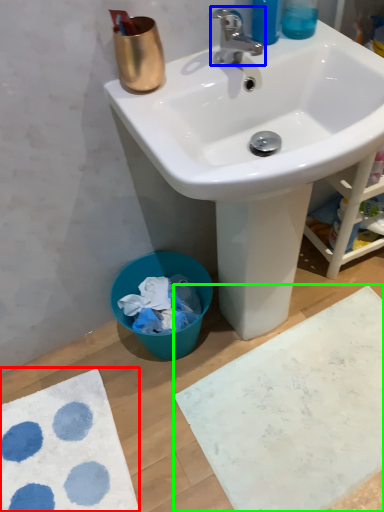
Question: Which object is positioned farthest from bath mat (highlighted by a red box)? Select from tap (highlighted by a blue box) and bath mat (highlighted by a green box).

Choices:
 (A) tap
 (B) bath mat

Answer: (A)